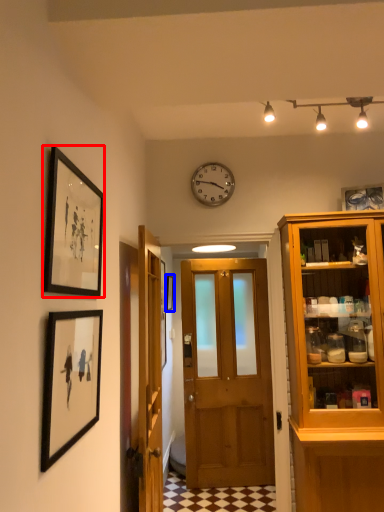
Question: Among these objects, which one is nearest to the camera, picture frame (highlighted by a red box) or picture frame (highlighted by a blue box)?

Choices:
 (A) picture frame
 (B) picture frame

Answer: (A)